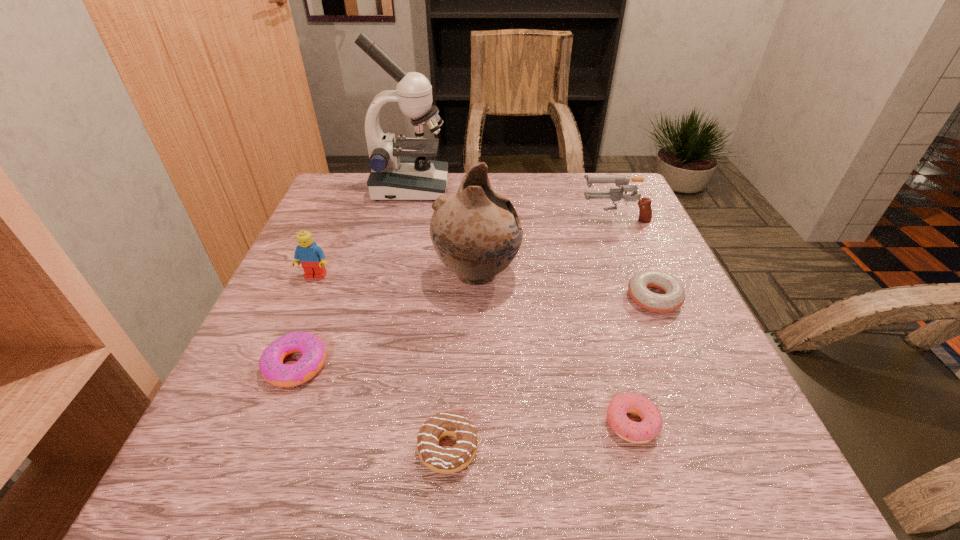
The image size is (960, 540). I want to click on the third doughnut from left to right, so click(x=641, y=432).

In order to click on free location located 0.270m on the front of the farthest object in this screenshot , I will do `click(392, 269)`.

This screenshot has height=540, width=960. Find the location of `free space located from the spout of the seventh shortest object`. free space located from the spout of the seventh shortest object is located at coordinates (593, 274).

This screenshot has width=960, height=540. Identify the location of free space located 0.050m at the barrel end of the second farthest object. coord(560,218).

In order to click on free region located at the barrel end of the second farthest object in this screenshot , I will do `click(466, 218)`.

This screenshot has width=960, height=540. I want to click on vacant space located at the barrel end of the second farthest object, so click(x=473, y=218).

This screenshot has width=960, height=540. In order to click on free location located 0.380m on the face of the Lego in this screenshot , I will do (240, 451).

Identify the location of vacant space located on the front of the farthest doughnut. Image resolution: width=960 pixels, height=540 pixels. (688, 376).

At what (x,y) coordinates should I click in order to perform the action: click on free location located on the back of the leftmost doughnut. Please return your answer as a coordinate pair (x, y). This screenshot has height=540, width=960. Looking at the image, I should click on (340, 252).

You are a GUI agent. You are given a task and a screenshot of the screen. Output one action in this format:
    pyautogui.click(x=<x>, y=<y>)
    Task: Click on the vacant space located 0.270m on the right of the third doughnut from right to left
    Image resolution: width=960 pixels, height=540 pixels.
    Given the screenshot: What is the action you would take?
    pyautogui.click(x=660, y=448)